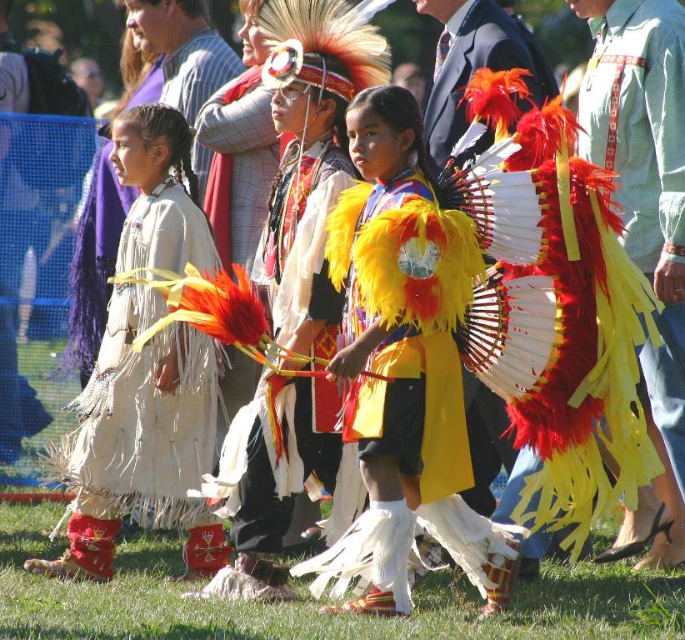
Question: Does feathered yellow dress at center have a smaller size compared to yellow feather headdress at center?

Choices:
 (A) no
 (B) yes

Answer: (B)

Question: Which point is farther to the camera?

Choices:
 (A) smooth white shirt at upper center
 (B) yellow feathered headdress at center

Answer: (A)

Question: Which object is farther from the camera taking this photo?

Choices:
 (A) yellow fabric headdress at center
 (B) smooth white shirt at upper center
 (C) beige fringe dress at center

Answer: (B)

Question: Does yellow feathered headdress at center have a greater width compared to beige fringe dress at center?

Choices:
 (A) no
 (B) yes

Answer: (A)

Question: Does feathered yellow dress at center appear on the right side of yellow feather headdress at center?

Choices:
 (A) no
 (B) yes

Answer: (A)

Question: Which object is positioned farthest from the beige fringe dress at center?

Choices:
 (A) feathered yellow dress at center
 (B) yellow fabric headdress at center
 (C) yellow feathered headdress at center
 (D) yellow feather headdress at center

Answer: (B)